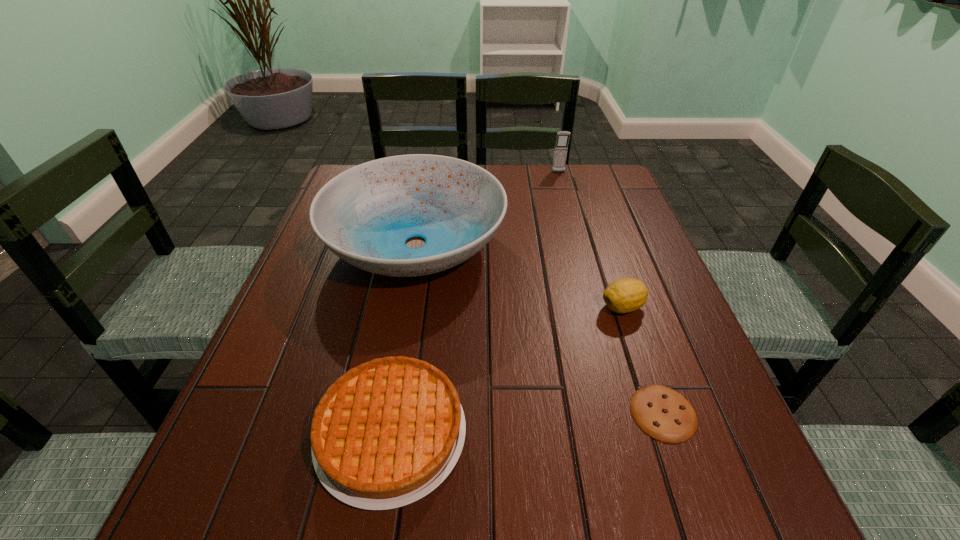
The image size is (960, 540). Find the location of `free space between the second shortest object and the third shortest object`. free space between the second shortest object and the third shortest object is located at coordinates (507, 370).

This screenshot has height=540, width=960. I want to click on vacant space that is in between the third tallest object and the farthest object, so click(590, 239).

Where is `unoccupied area between the pie and the shortest object`? Image resolution: width=960 pixels, height=540 pixels. unoccupied area between the pie and the shortest object is located at coordinates point(527,423).

Where is `free point between the fourth tallest object and the cookie`? Image resolution: width=960 pixels, height=540 pixels. free point between the fourth tallest object and the cookie is located at coordinates (527, 423).

Choose which object is the nearest neighbor to the farthest object. Please provide its 2D coordinates. Your answer should be formatted as a tuple, i.e. [(x, y)], where the tuple contains the x and y coordinates of a point satisfying the conditions above.

[(364, 215)]

Identify the location of the closest object to the farthest object. (364, 215).

Where is `vacant space that satisfies the following two spatial constraints: 1. at the stem end of the lemon; 2. on the right side of the cookie`? The height and width of the screenshot is (540, 960). vacant space that satisfies the following two spatial constraints: 1. at the stem end of the lemon; 2. on the right side of the cookie is located at coordinates (658, 413).

Locate an element on the screen. This screenshot has width=960, height=540. free space that satisfies the following two spatial constraints: 1. at the stem end of the cookie; 2. on the right side of the lemon is located at coordinates (658, 413).

This screenshot has height=540, width=960. I want to click on free spot that satisfies the following two spatial constraints: 1. at the stem end of the lemon; 2. on the right side of the shortest object, so click(x=658, y=413).

Image resolution: width=960 pixels, height=540 pixels. Find the location of `free point that satisfies the following two spatial constraints: 1. on the front side of the shortest object; 2. on the right side of the dish`. free point that satisfies the following two spatial constraints: 1. on the front side of the shortest object; 2. on the right side of the dish is located at coordinates (386, 413).